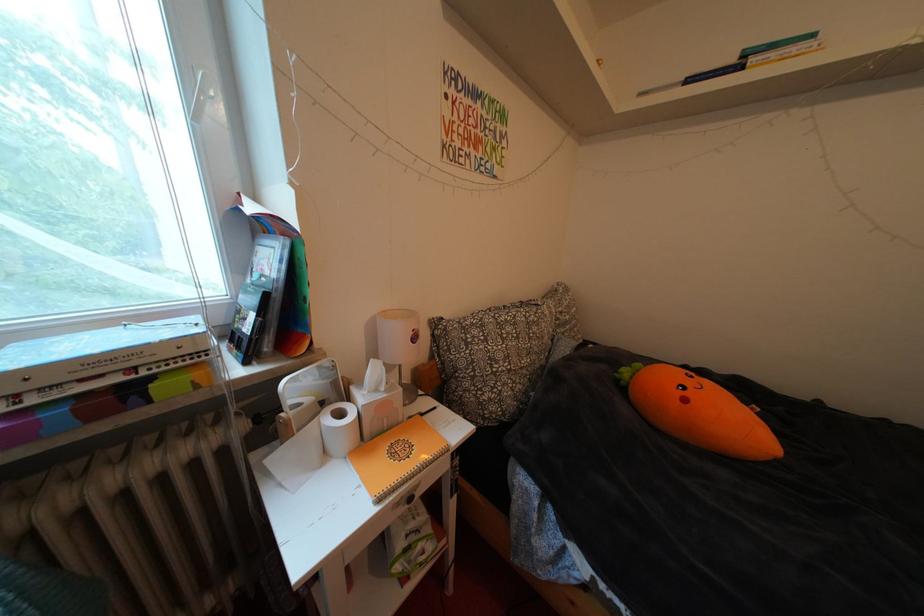
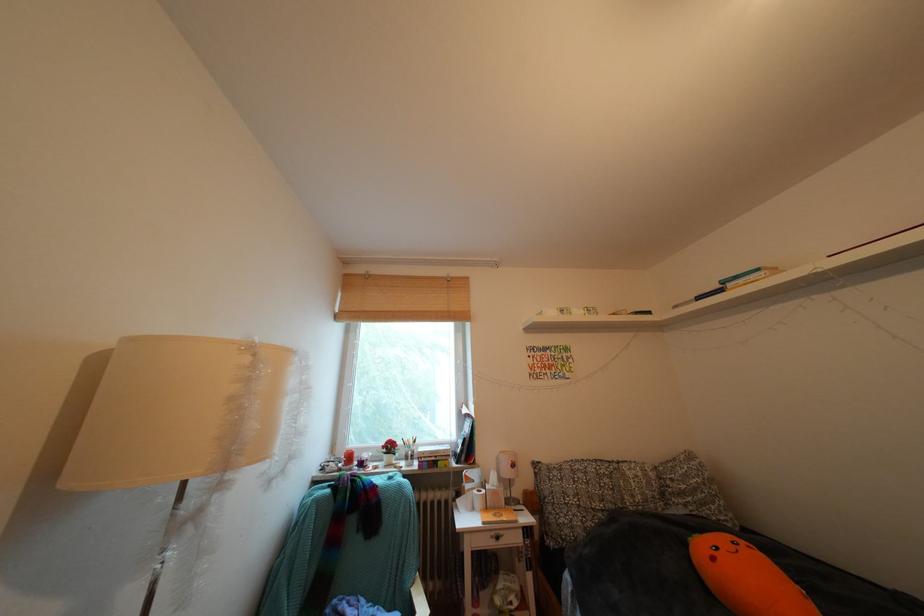
In the second image, find the point that corresponds to pixel 570 318 in the first image.

(682, 485)